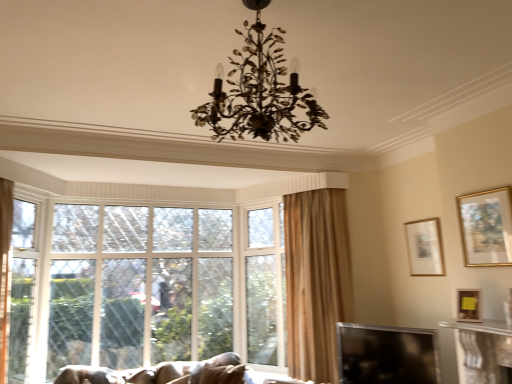
Question: Is clear glass screen door at left far from velvet brown sofa at lower left?

Choices:
 (A) yes
 (B) no

Answer: (A)

Question: From the image's perspective, would you say clear glass screen door at left is shown under velvet brown sofa at lower left?

Choices:
 (A) yes
 (B) no

Answer: (B)

Question: Considering the relative sizes of clear glass screen door at left and velvet brown sofa at lower left in the image provided, is clear glass screen door at left thinner than velvet brown sofa at lower left?

Choices:
 (A) no
 (B) yes

Answer: (B)

Question: Is clear glass screen door at left at the left side of velvet brown sofa at lower left?

Choices:
 (A) yes
 (B) no

Answer: (A)

Question: Does clear glass screen door at left have a greater height compared to velvet brown sofa at lower left?

Choices:
 (A) no
 (B) yes

Answer: (B)

Question: In the image, is clear glass screen door at left positioned in front of or behind velvet brown sofa at lower left?

Choices:
 (A) behind
 (B) front

Answer: (A)

Question: Is point (29, 271) closer or farther from the camera than point (119, 370)?

Choices:
 (A) closer
 (B) farther

Answer: (A)

Question: Looking at the image, does clear glass screen door at left seem bigger or smaller compared to velvet brown sofa at lower left?

Choices:
 (A) big
 (B) small

Answer: (B)

Question: Considering the positions of clear glass screen door at left and velvet brown sofa at lower left in the image, is clear glass screen door at left wider or thinner than velvet brown sofa at lower left?

Choices:
 (A) wide
 (B) thin

Answer: (B)

Question: From the image's perspective, is matte gold picture frame at upper right, placed as the first picture frame when sorted from back to front, located above or below velvet brown sofa at lower left?

Choices:
 (A) above
 (B) below

Answer: (A)

Question: In the image, is matte gold picture frame at upper right, which appears as the third picture frame when viewed from the front, positioned in front of or behind velvet brown sofa at lower left?

Choices:
 (A) behind
 (B) front

Answer: (A)

Question: Considering the positions of matte gold picture frame at upper right, which appears as the third picture frame when viewed from the front, and velvet brown sofa at lower left in the image, is matte gold picture frame at upper right, which appears as the third picture frame when viewed from the front, bigger or smaller than velvet brown sofa at lower left?

Choices:
 (A) big
 (B) small

Answer: (B)

Question: In terms of height, does matte gold picture frame at upper right, placed as the first picture frame when sorted from back to front, look taller or shorter compared to velvet brown sofa at lower left?

Choices:
 (A) short
 (B) tall

Answer: (B)

Question: Is transparent glass window screen at lower right wider or thinner than gold metallic chandelier at center?

Choices:
 (A) thin
 (B) wide

Answer: (A)

Question: Considering the relative positions of transparent glass window screen at lower right and gold metallic chandelier at center in the image provided, is transparent glass window screen at lower right to the left or to the right of gold metallic chandelier at center?

Choices:
 (A) right
 (B) left

Answer: (A)